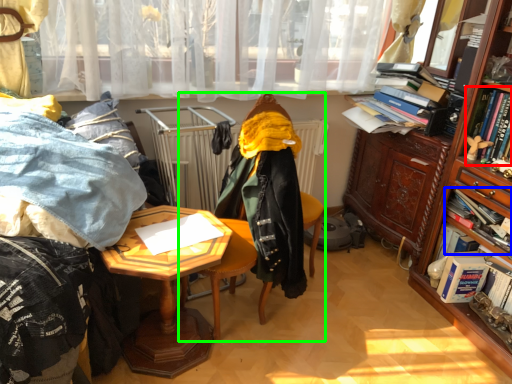
Question: Based on their relative distances, which object is farther from book (highlighted by a red box)? Choose from book (highlighted by a blue box) and chair (highlighted by a green box).

Choices:
 (A) book
 (B) chair

Answer: (B)